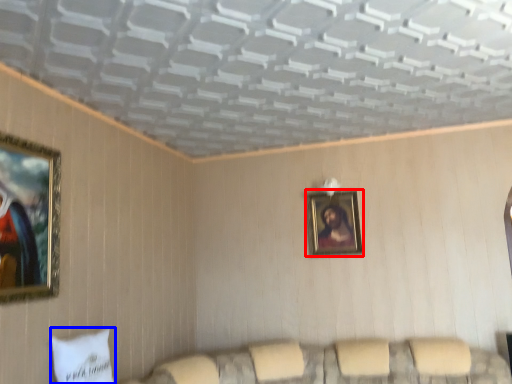
Question: Among these objects, which one is farthest to the camera, picture frame (highlighted by a red box) or pillow (highlighted by a blue box)?

Choices:
 (A) picture frame
 (B) pillow

Answer: (A)